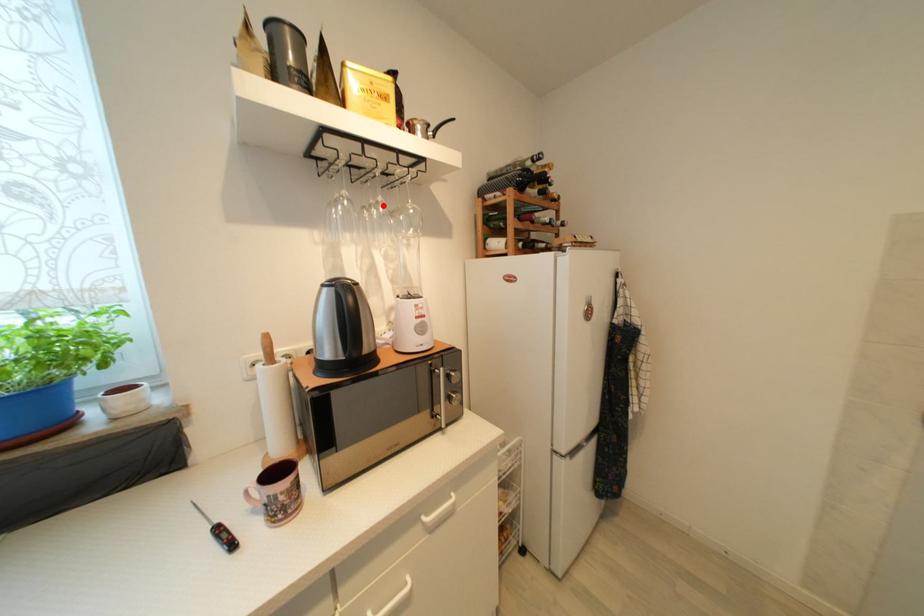
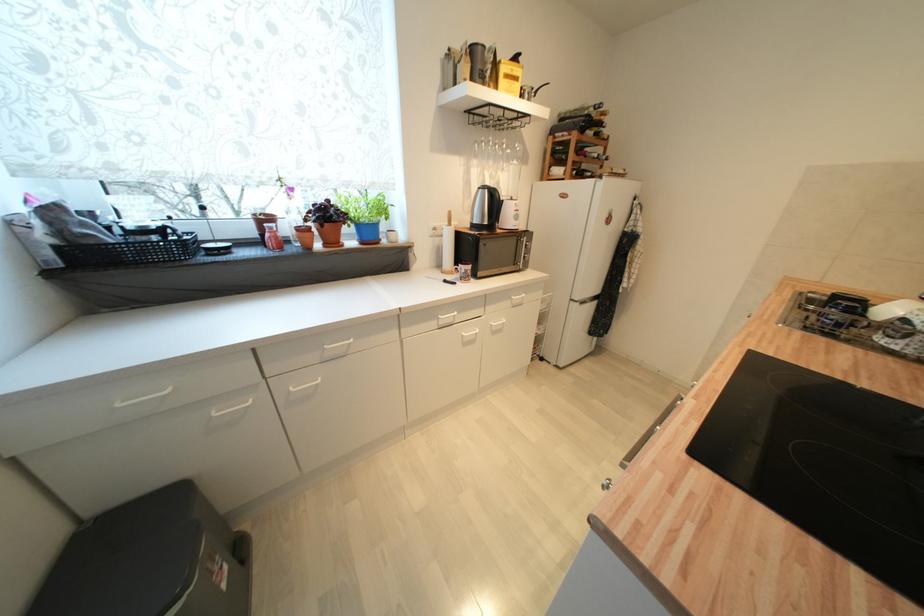
Locate, in the second image, the point that corresponds to the highlighted location in the first image.

(507, 146)